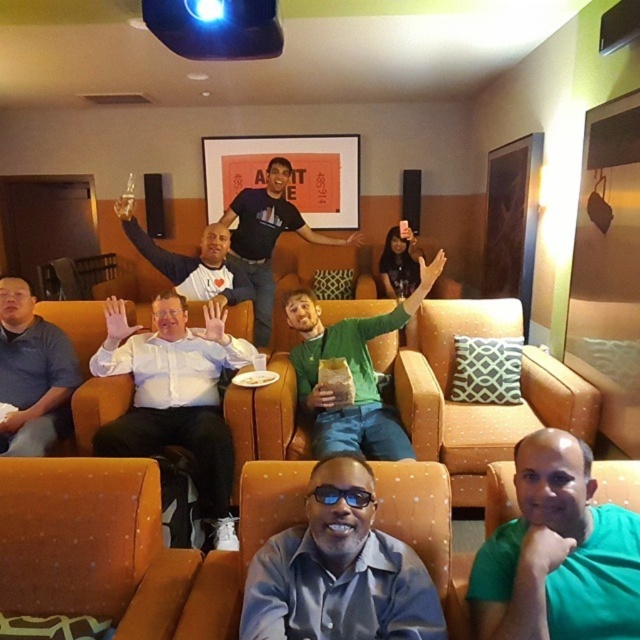
Can you confirm if green matte shirt at lower right is shorter than matte black t-shirt at center?

Indeed, green matte shirt at lower right has a lesser height compared to matte black t-shirt at center.

Which is behind, point (577, 515) or point (264, 216)?

The point (264, 216) is more distant.

This screenshot has width=640, height=640. Describe the element at coordinates (557, 554) in the screenshot. I see `green matte shirt at lower right` at that location.

In order to click on green matte shirt at lower right in this screenshot , I will do `click(557, 554)`.

Does dark blue sweater at center have a smaller size compared to black plastic goggles at center?

No, dark blue sweater at center is not smaller than black plastic goggles at center.

Which of these two, dark blue sweater at center or black plastic goggles at center, stands taller?

dark blue sweater at center is taller.

Between point (236, 272) and point (316, 493), which one is positioned in front?

Point (316, 493) is more forward.

Where is `dark blue sweater at center`? dark blue sweater at center is located at coordinates (189, 260).

Is matte black t-shirt at center thinner than dark blue sweater at center?

Incorrect, matte black t-shirt at center's width is not less than dark blue sweater at center's.

Which is below, matte black t-shirt at center or dark blue sweater at center?

Positioned lower is dark blue sweater at center.

At what (x,y) coordinates should I click in order to perform the action: click on matte black t-shirt at center. Please return your answer as a coordinate pair (x, y). This screenshot has height=640, width=640. Looking at the image, I should click on (268, 237).